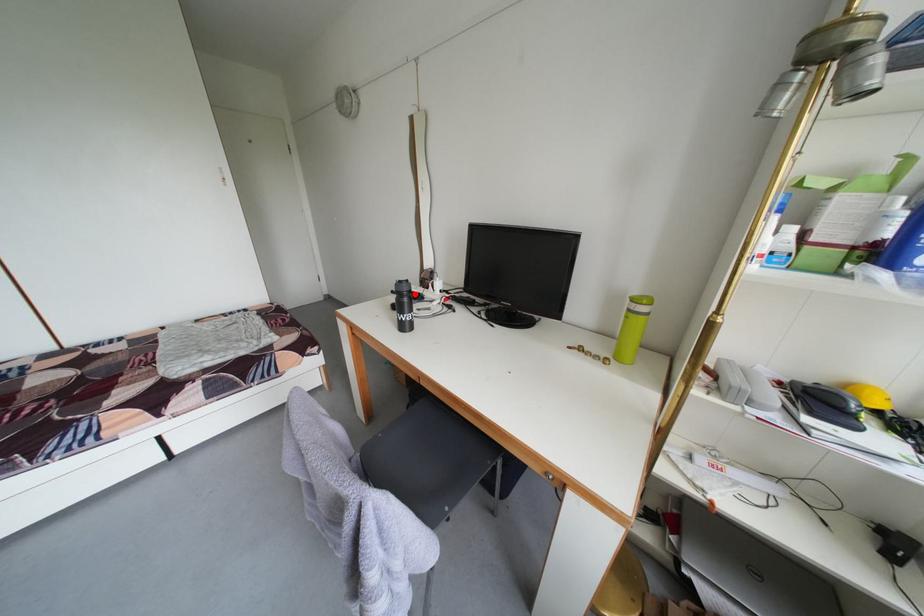
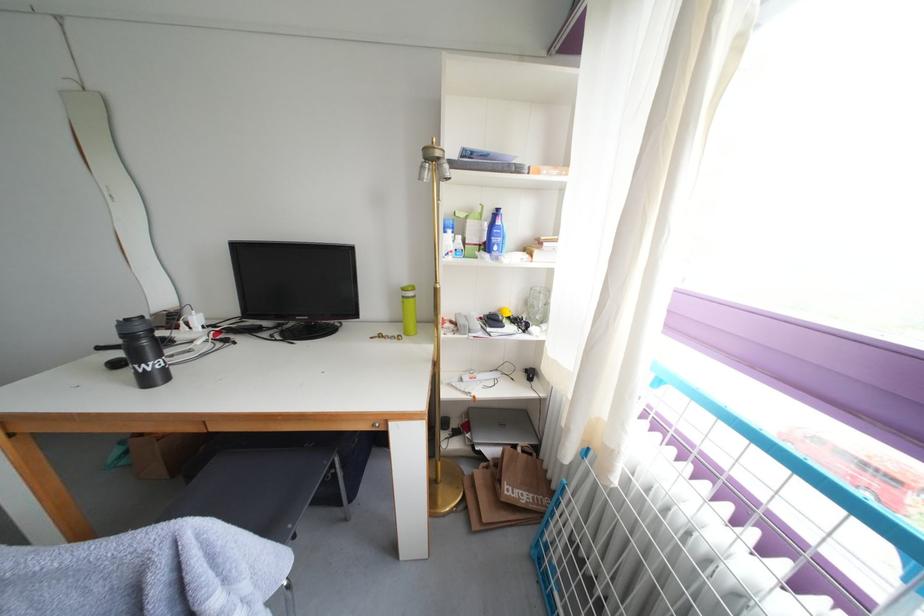
Question: A red point is marked in image1. In image2, is the corresponding 3D point closer to the camera or farther? Reply with the corresponding letter.

Choices:
 (A) The corresponding 3D point is closer.
 (B) The corresponding 3D point is farther.

Answer: (B)